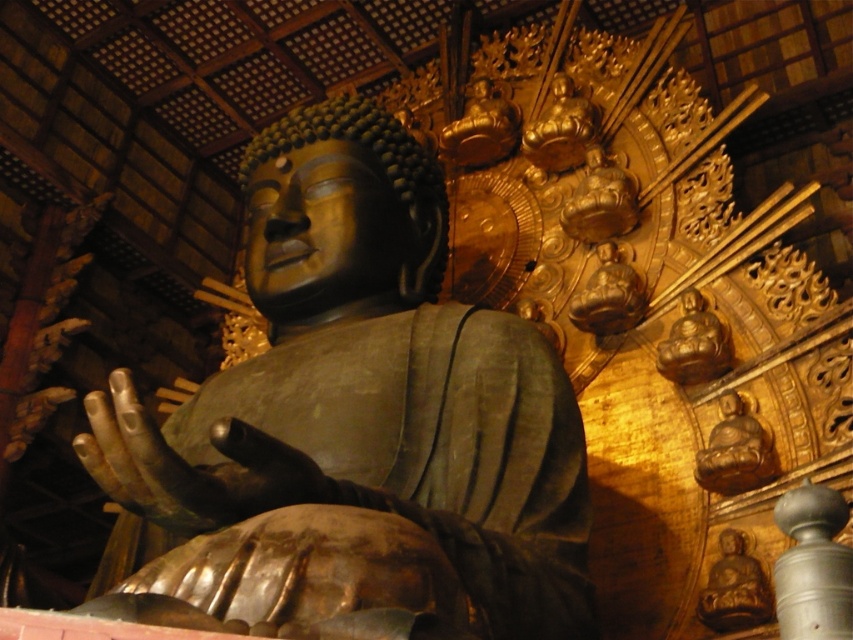
Question: Is gold polished statue at lower right to the right of gold polished statue at upper right from the viewer's perspective?

Choices:
 (A) no
 (B) yes

Answer: (B)

Question: Among these objects, which one is nearest to the camera?

Choices:
 (A) gold polished statue at upper right
 (B) matte gold statue at upper right

Answer: (B)

Question: Is gold polished statue at lower right below gold polished statue at upper right?

Choices:
 (A) yes
 (B) no

Answer: (A)

Question: Which object is farther from the camera taking this photo?

Choices:
 (A) matte gold statue at upper right
 (B) bronze statue at center
 (C) gold polished statue at lower right
 (D) gold polished statue at upper right

Answer: (D)

Question: Where is matte gold statue at upper right located in relation to gold polished statue at lower right in the image?

Choices:
 (A) left
 (B) right

Answer: (B)

Question: Which object is closer to the camera taking this photo?

Choices:
 (A) bronze/golden hand at center
 (B) gold polished statue at lower right

Answer: (A)